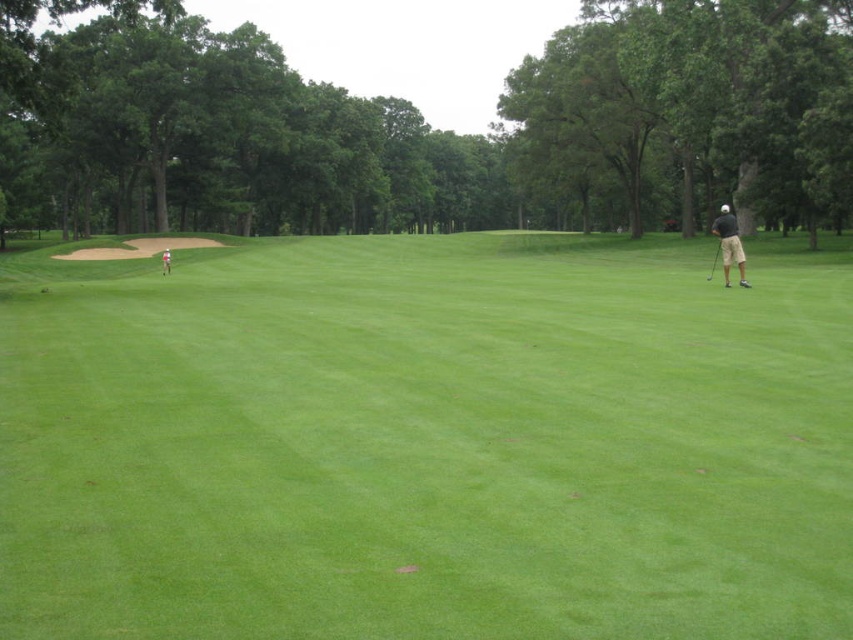
Question: Which object is positioned farthest from the green grassy field at center?

Choices:
 (A) black fabric golf club at right
 (B) metallic silver golf club at right
 (C) dark gray shorts at right

Answer: (C)

Question: Is green grassy field at center positioned before metallic silver golf club at right?

Choices:
 (A) no
 (B) yes

Answer: (B)

Question: Which point is farther from the camera taking this photo?

Choices:
 (A) (717, 256)
 (B) (421, 416)
 (C) (165, 252)
 (D) (735, 250)

Answer: (C)

Question: Can you confirm if black fabric golf club at right is bigger than metallic silver golf club at right?

Choices:
 (A) no
 (B) yes

Answer: (B)

Question: Which object appears closest to the camera in this image?

Choices:
 (A) dark gray shorts at right
 (B) green grassy field at center

Answer: (B)

Question: Does green grassy field at center appear on the left side of dark gray shorts at right?

Choices:
 (A) yes
 (B) no

Answer: (B)